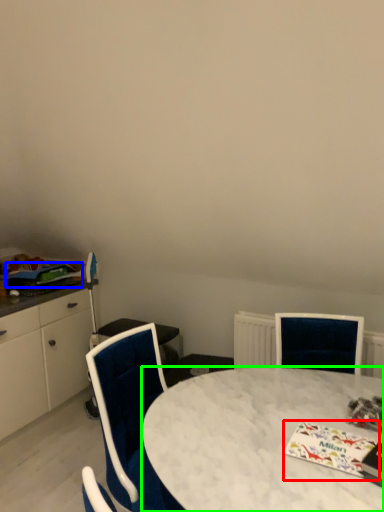
Question: Which object is the closest to the magazine (highlighted by a red box)? Choose among these: magazine (highlighted by a blue box) or desk (highlighted by a green box).

Choices:
 (A) magazine
 (B) desk

Answer: (B)